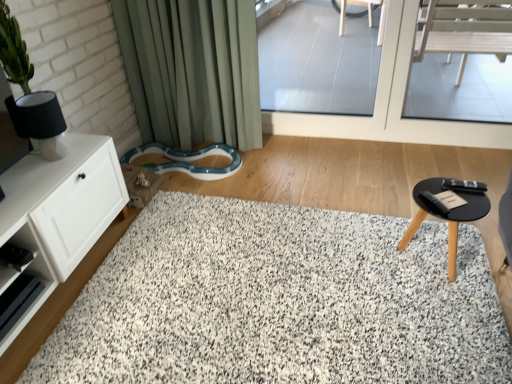
Question: Is the position of green fabric curtain at upper left less distant than that of transparent glass door at upper center, the 2th window screen from the right?

Choices:
 (A) yes
 (B) no

Answer: (A)

Question: Is green fabric curtain at upper left aimed at transparent glass door at upper center, which appears as the 1th window screen when viewed from the left?

Choices:
 (A) no
 (B) yes

Answer: (A)

Question: Would you say green fabric curtain at upper left contains transparent glass door at upper center, the 2th window screen from the right?

Choices:
 (A) no
 (B) yes

Answer: (A)

Question: Does green fabric curtain at upper left have a lesser height compared to transparent glass door at upper center, the 2th window screen from the right?

Choices:
 (A) no
 (B) yes

Answer: (A)

Question: Is green fabric curtain at upper left wider than transparent glass door at upper center, the 2th window screen from the right?

Choices:
 (A) yes
 (B) no

Answer: (A)

Question: Considering the relative sizes of green fabric curtain at upper left and transparent glass door at upper center, which appears as the 1th window screen when viewed from the left, in the image provided, is green fabric curtain at upper left bigger than transparent glass door at upper center, which appears as the 1th window screen when viewed from the left,?

Choices:
 (A) yes
 (B) no

Answer: (A)

Question: Is transparent glass door at upper center, the 2th window screen from the right, touching white matte cabinet at left?

Choices:
 (A) yes
 (B) no

Answer: (B)

Question: From a real-world perspective, is transparent glass door at upper center, which appears as the 1th window screen when viewed from the left, positioned under white matte cabinet at left based on gravity?

Choices:
 (A) yes
 (B) no

Answer: (B)

Question: Is transparent glass door at upper center, which appears as the 1th window screen when viewed from the left, at the right side of white matte cabinet at left?

Choices:
 (A) no
 (B) yes

Answer: (B)

Question: Considering the relative sizes of transparent glass door at upper center, the 2th window screen from the right, and white matte cabinet at left in the image provided, is transparent glass door at upper center, the 2th window screen from the right, smaller than white matte cabinet at left?

Choices:
 (A) yes
 (B) no

Answer: (A)

Question: Is white matte cabinet at left inside transparent glass door at upper center, which appears as the 1th window screen when viewed from the left?

Choices:
 (A) yes
 (B) no

Answer: (B)

Question: Can you confirm if transparent glass door at upper center, the 2th window screen from the right, is shorter than white matte cabinet at left?

Choices:
 (A) yes
 (B) no

Answer: (B)

Question: From the image's perspective, is white shaggy rug at center on transparent glass door at upper center, the 2th window screen from the right?

Choices:
 (A) yes
 (B) no

Answer: (B)